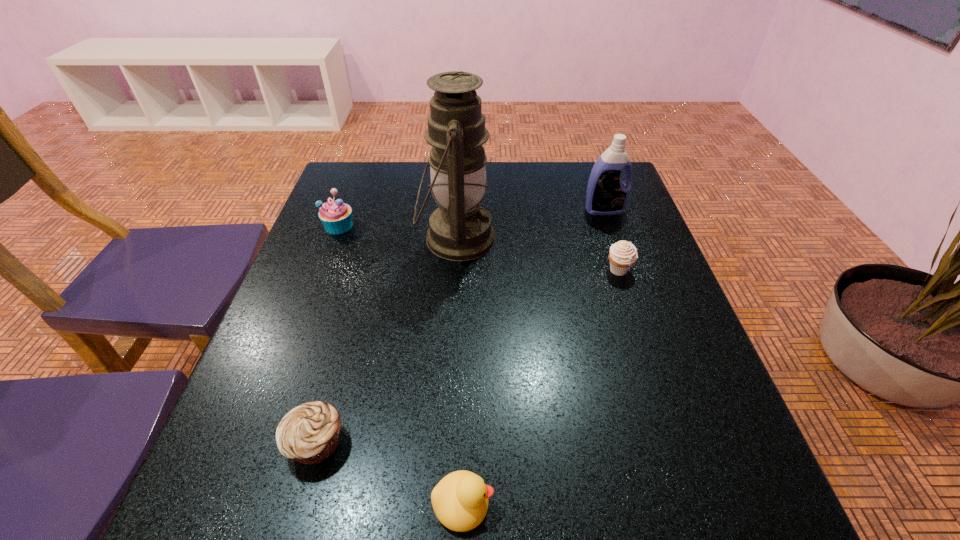
Find the location of `free region located on the front of the leftmost object`. free region located on the front of the leftmost object is located at coordinates (295, 342).

Locate an element on the screen. The width and height of the screenshot is (960, 540). vacant region located on the back of the second farthest muffin is located at coordinates (588, 179).

Locate an element on the screen. vacant space situated on the back of the fifth farthest object is located at coordinates (365, 267).

Identify the location of free space located on the face of the duckling. The height and width of the screenshot is (540, 960). (706, 503).

Locate an element on the screen. The height and width of the screenshot is (540, 960). object that is positioned at the far edge is located at coordinates (607, 194).

You are a GUI agent. You are given a task and a screenshot of the screen. Output one action in this format:
    pyautogui.click(x=<x>, y=<y>)
    Task: Click on the muffin that is at the near edge
    The width and height of the screenshot is (960, 540).
    Given the screenshot: What is the action you would take?
    pyautogui.click(x=310, y=433)

Locate an element on the screen. This screenshot has width=960, height=540. duckling present at the near edge is located at coordinates (460, 500).

You are a GUI agent. You are given a task and a screenshot of the screen. Output one action in this format:
    pyautogui.click(x=<x>, y=<y>)
    Task: Click on the detergent at the right edge
    This screenshot has height=540, width=960.
    Given the screenshot: What is the action you would take?
    pyautogui.click(x=607, y=194)

This screenshot has height=540, width=960. I want to click on muffin located in the right edge section of the desktop, so click(x=623, y=254).

Locate an element on the screen. object positioned at the near left corner is located at coordinates (310, 433).